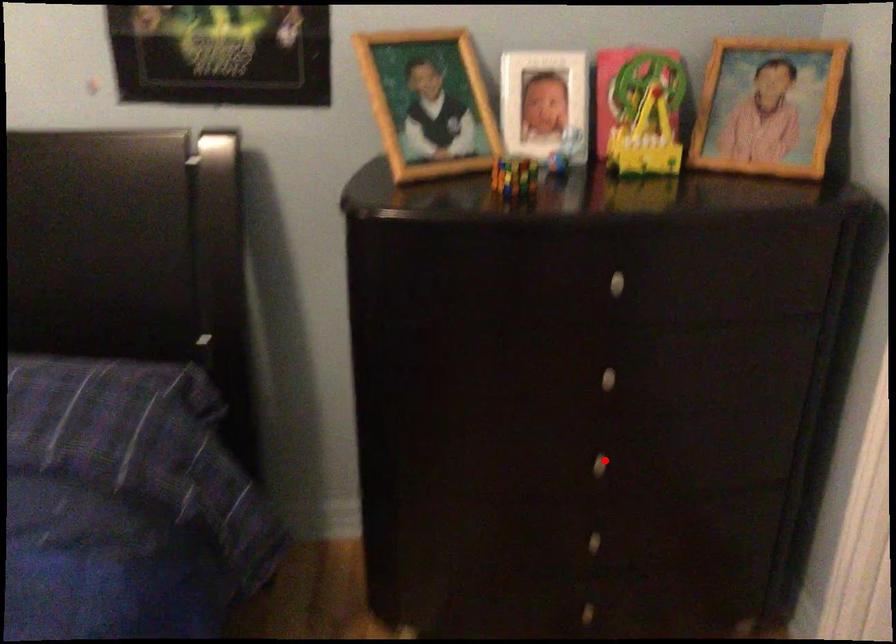
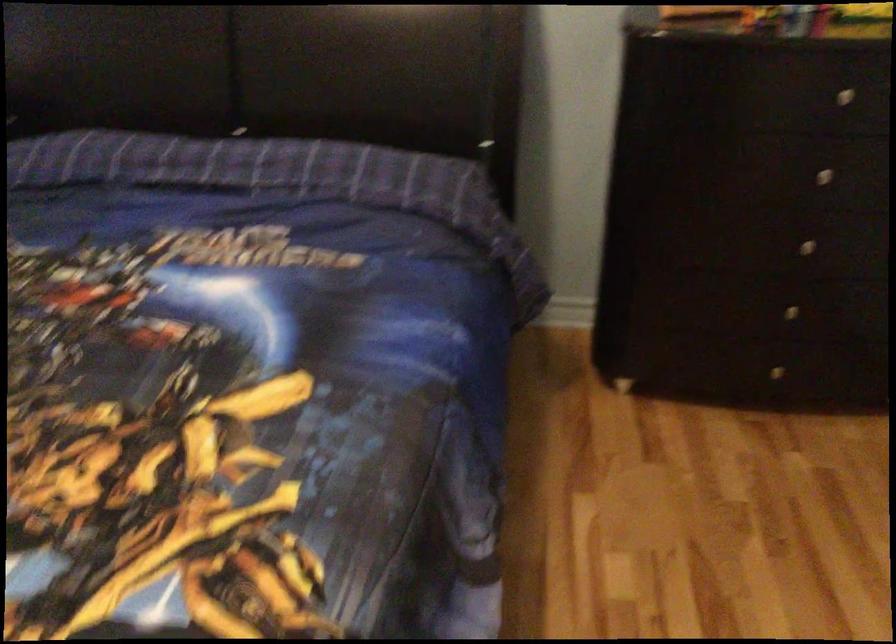
In the second image, find the point that corresponds to the highlighted location in the first image.

(805, 245)